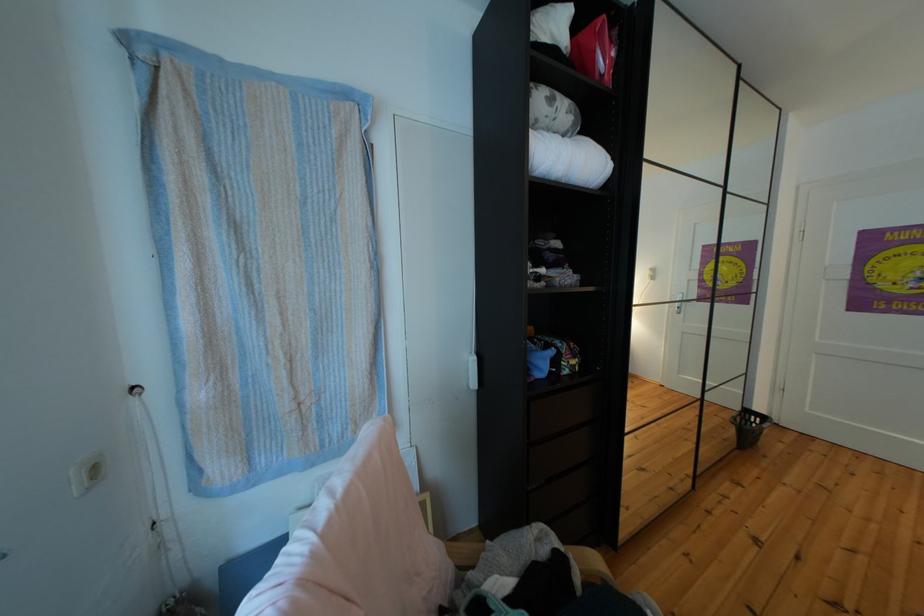
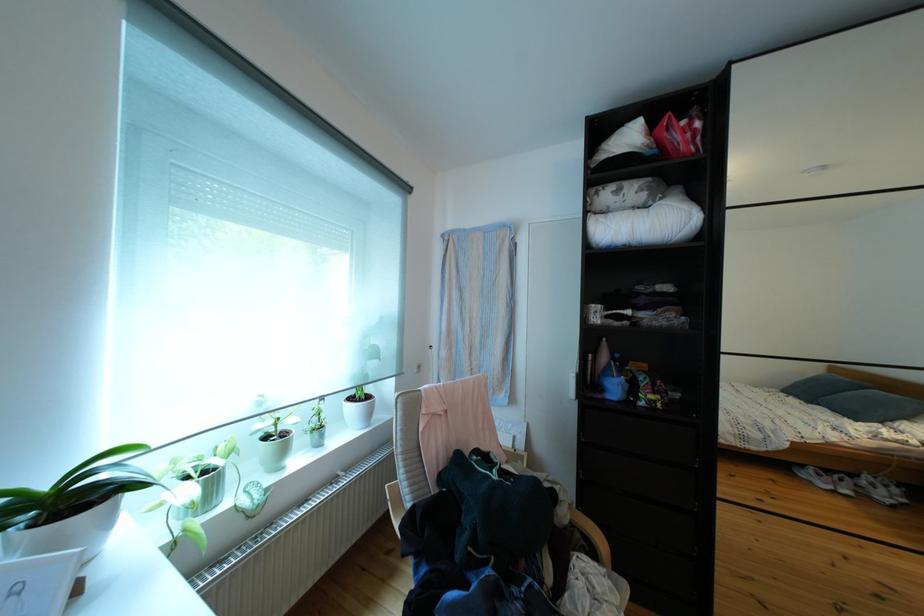
Question: The images are taken continuously from a first-person perspective. In which direction is your viewpoint rotating?

Choices:
 (A) Left
 (B) Right
 (C) Up
 (D) Down

Answer: (A)